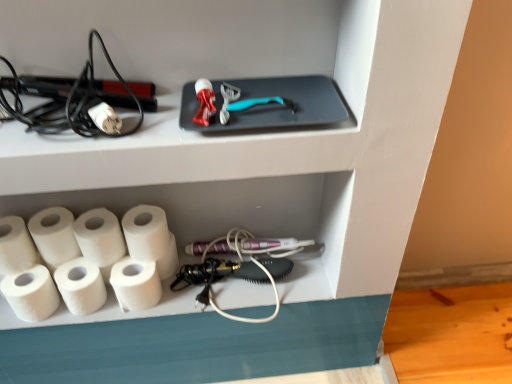
I want to click on vacant area on top of white matte toilet paper rolls at lower left (from a real-world perspective), so click(x=217, y=276).